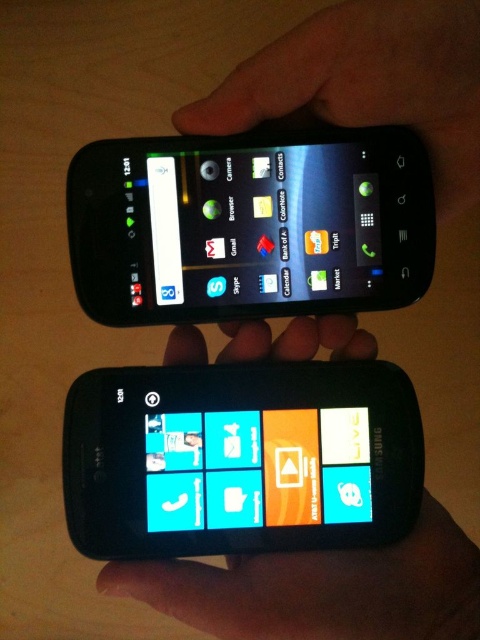
Question: Which point is closer to the camera taking this photo?

Choices:
 (A) (384, 163)
 (B) (245, 481)
 (C) (333, 401)
 (D) (361, 44)

Answer: (D)

Question: Does matte black smartphone at center lie behind black matte hand at upper center?

Choices:
 (A) yes
 (B) no

Answer: (A)

Question: Does matte black smartphone at center have a larger size compared to matte black smartphone at upper center?

Choices:
 (A) yes
 (B) no

Answer: (B)

Question: Is matte black smartphone at center to the left of matte plastic phone at upper center from the viewer's perspective?

Choices:
 (A) yes
 (B) no

Answer: (A)

Question: Which of the following is the closest to the observer?

Choices:
 (A) black matte hand at upper center
 (B) matte black smartphone at center
 (C) matte black smartphone at upper center
 (D) matte plastic phone at upper center

Answer: (A)

Question: Which of the following is the farthest from the observer?

Choices:
 (A) matte black smartphone at upper center
 (B) matte plastic phone at upper center
 (C) black matte hand at upper center

Answer: (B)